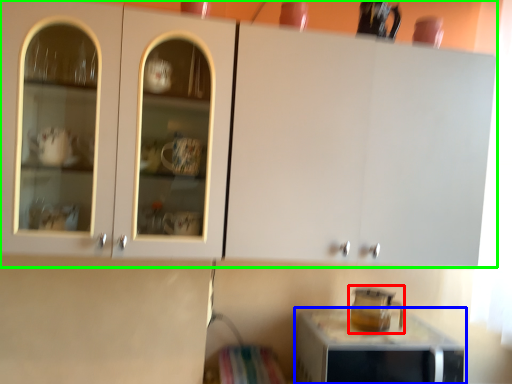
Question: Which is farther away from appliance (highlighted by a red box)? home appliance (highlighted by a blue box) or cabinetry (highlighted by a green box)?

Choices:
 (A) home appliance
 (B) cabinetry

Answer: (B)